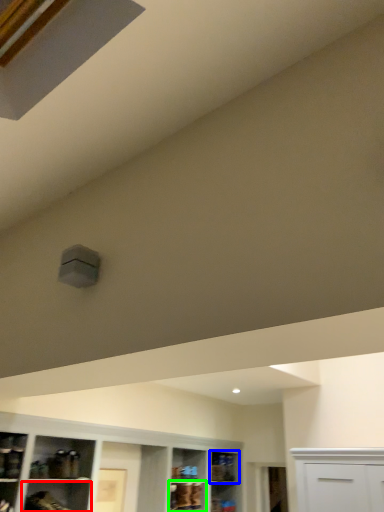
Question: Which object is the farthest from shelf (highlighted by a red box)? Choose among these: shelf (highlighted by a blue box) or cabinet (highlighted by a green box).

Choices:
 (A) shelf
 (B) cabinet

Answer: (A)